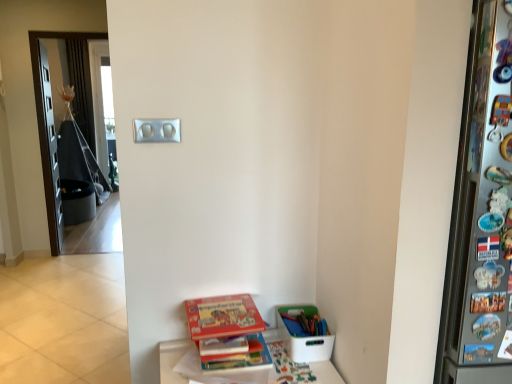
Question: Can you confirm if hardcover book at lower center, the 1th book positioned from the bottom, is wider than white plastic container at lower right?

Choices:
 (A) yes
 (B) no

Answer: (B)

Question: Is hardcover book at lower center, marked as the second book in a top-to-bottom arrangement, aimed at white plastic container at lower right?

Choices:
 (A) yes
 (B) no

Answer: (B)

Question: Is hardcover book at lower center, the 1th book positioned from the bottom, positioned with its back to white plastic container at lower right?

Choices:
 (A) yes
 (B) no

Answer: (B)

Question: From a real-world perspective, is hardcover book at lower center, marked as the second book in a top-to-bottom arrangement, physically above white plastic container at lower right?

Choices:
 (A) no
 (B) yes

Answer: (A)

Question: Does hardcover book at lower center, the 1th book positioned from the bottom, have a smaller size compared to white plastic container at lower right?

Choices:
 (A) no
 (B) yes

Answer: (B)

Question: Can you confirm if hardcover book at lower center, the 1th book positioned from the bottom, is positioned to the right of white plastic container at lower right?

Choices:
 (A) no
 (B) yes

Answer: (A)

Question: From a real-world perspective, is hardcover book at lower center, marked as the second book in a top-to-bottom arrangement, below silver metallic light switch at upper center?

Choices:
 (A) no
 (B) yes

Answer: (B)

Question: Is silver metallic light switch at upper center at the back of hardcover book at lower center, the 1th book positioned from the bottom?

Choices:
 (A) no
 (B) yes

Answer: (A)

Question: Is hardcover book at lower center, marked as the second book in a top-to-bottom arrangement, wider than silver metallic light switch at upper center?

Choices:
 (A) no
 (B) yes

Answer: (B)

Question: Could you tell me if hardcover book at lower center, the 1th book positioned from the bottom, is turned towards silver metallic light switch at upper center?

Choices:
 (A) yes
 (B) no

Answer: (B)

Question: Does hardcover book at lower center, marked as the second book in a top-to-bottom arrangement, touch silver metallic light switch at upper center?

Choices:
 (A) yes
 (B) no

Answer: (B)

Question: From the image's perspective, is hardcover book at lower center, marked as the second book in a top-to-bottom arrangement, below silver metallic light switch at upper center?

Choices:
 (A) no
 (B) yes

Answer: (B)

Question: Does hardcover book at lower center, which ranks as the 1th book in top-to-bottom order, come behind silver metallic light switch at upper center?

Choices:
 (A) no
 (B) yes

Answer: (A)